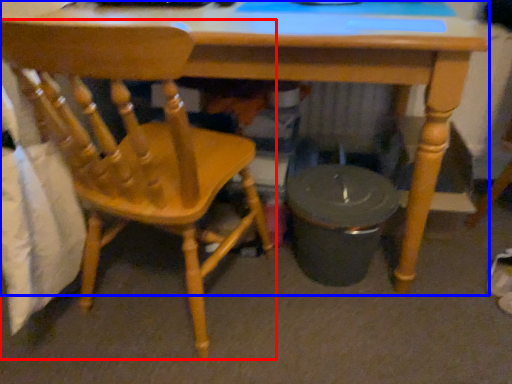
Question: Which object appears farthest to the camera in this image, chair (highlighted by a red box) or desk (highlighted by a blue box)?

Choices:
 (A) chair
 (B) desk

Answer: (B)